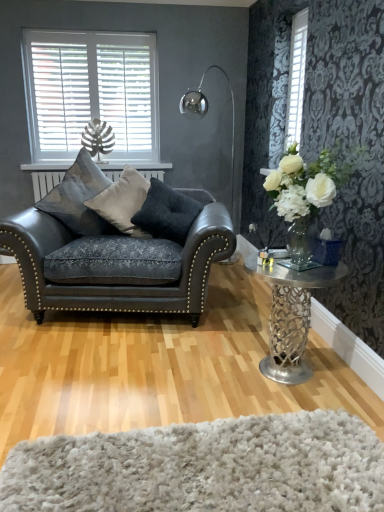
Locate an element on the screen. Image resolution: width=384 pixels, height=512 pixels. vacant region above white shaggy rug at lower center (from a real-world perspective) is located at coordinates coord(210,459).